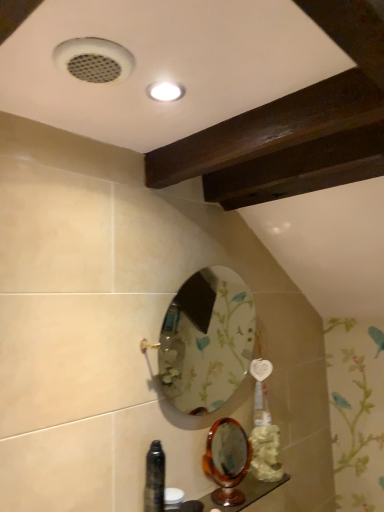
Question: Should I look upward or downward to see wooden polished mirror at lower center, placed as the first mirror when sorted from bottom to top?

Choices:
 (A) down
 (B) up

Answer: (A)

Question: Is wooden polished counter top at lower center closer to the viewer compared to black glossy bottle at lower left?

Choices:
 (A) yes
 (B) no

Answer: (B)

Question: Is wooden polished counter top at lower center not close to black glossy bottle at lower left?

Choices:
 (A) yes
 (B) no

Answer: (B)

Question: Is wooden polished counter top at lower center further to camera compared to black glossy bottle at lower left?

Choices:
 (A) no
 (B) yes

Answer: (B)

Question: Can you see wooden polished counter top at lower center touching black glossy bottle at lower left?

Choices:
 (A) yes
 (B) no

Answer: (B)

Question: From the image's perspective, is wooden polished counter top at lower center under black glossy bottle at lower left?

Choices:
 (A) no
 (B) yes

Answer: (B)

Question: Can you confirm if wooden polished counter top at lower center is thinner than black glossy bottle at lower left?

Choices:
 (A) yes
 (B) no

Answer: (B)

Question: Is floral-patterned glass mirror at center, the 1th mirror positioned from the top, positioned with its back to wooden polished mirror at lower center, acting as the 2th mirror starting from the top?

Choices:
 (A) no
 (B) yes

Answer: (A)

Question: Does floral-patterned glass mirror at center, the 1th mirror positioned from the top, come in front of wooden polished mirror at lower center, placed as the first mirror when sorted from bottom to top?

Choices:
 (A) no
 (B) yes

Answer: (B)

Question: Can you confirm if floral-patterned glass mirror at center, which is counted as the 2th mirror, starting from the bottom, is bigger than wooden polished mirror at lower center, acting as the 2th mirror starting from the top?

Choices:
 (A) yes
 (B) no

Answer: (A)

Question: From the image's perspective, is floral-patterned glass mirror at center, the 1th mirror positioned from the top, over wooden polished mirror at lower center, acting as the 2th mirror starting from the top?

Choices:
 (A) yes
 (B) no

Answer: (A)

Question: Can you confirm if floral-patterned glass mirror at center, which is counted as the 2th mirror, starting from the bottom, is smaller than wooden polished mirror at lower center, acting as the 2th mirror starting from the top?

Choices:
 (A) no
 (B) yes

Answer: (A)

Question: Can you confirm if floral-patterned glass mirror at center, which is counted as the 2th mirror, starting from the bottom, is thinner than wooden polished mirror at lower center, acting as the 2th mirror starting from the top?

Choices:
 (A) no
 (B) yes

Answer: (A)

Question: Is floral-patterned glass mirror at center, which is counted as the 2th mirror, starting from the bottom, not within wooden polished counter top at lower center?

Choices:
 (A) yes
 (B) no

Answer: (A)